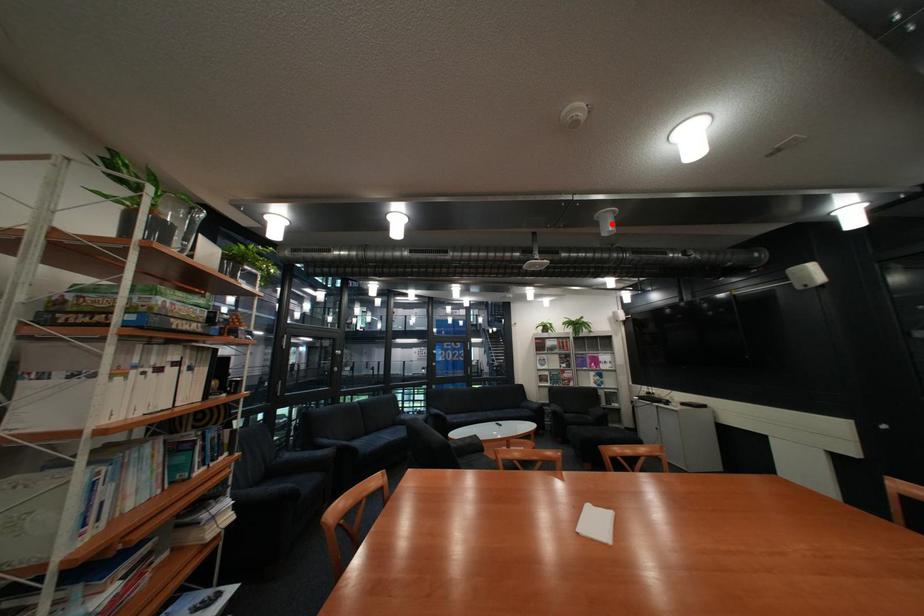
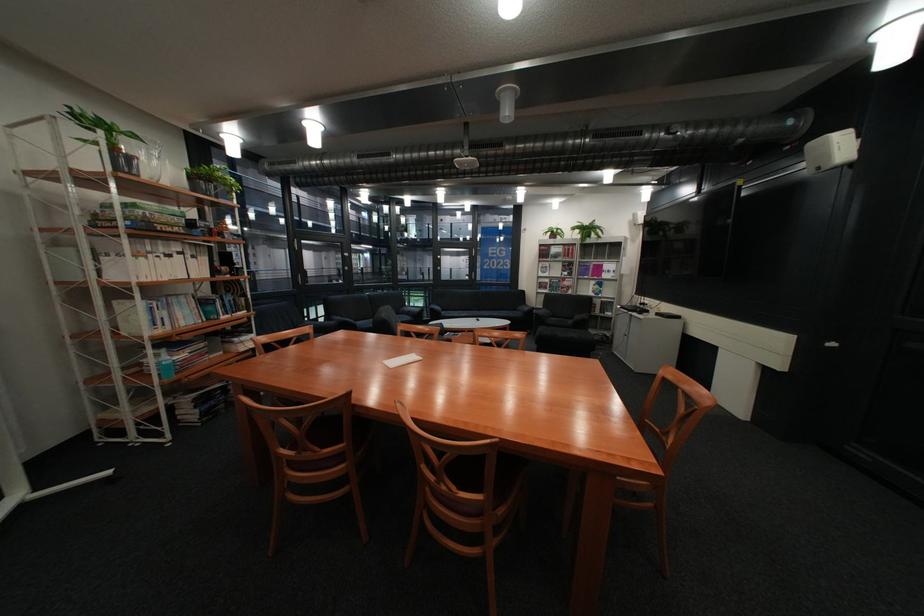
Question: I am providing you with two images of the same scene from different viewpoints. In image1, a red point is highlighted. Considering the same 3D point in image2, which of the following is correct?

Choices:
 (A) It is closer
 (B) It is farther

Answer: (B)